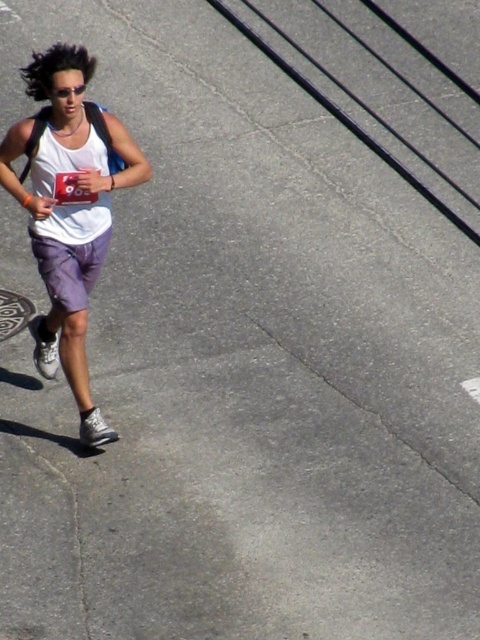
Which is behind, point (90, 154) or point (92, 272)?

Positioned behind is point (92, 272).

Does white matte tank top at left appear under purple cotton shorts at lower left?

No.

Measure the distance between white matte tank top at left and camera.

white matte tank top at left is 5.77 meters away from camera.

Where is `white matte tank top at left`? white matte tank top at left is located at coordinates (69, 209).